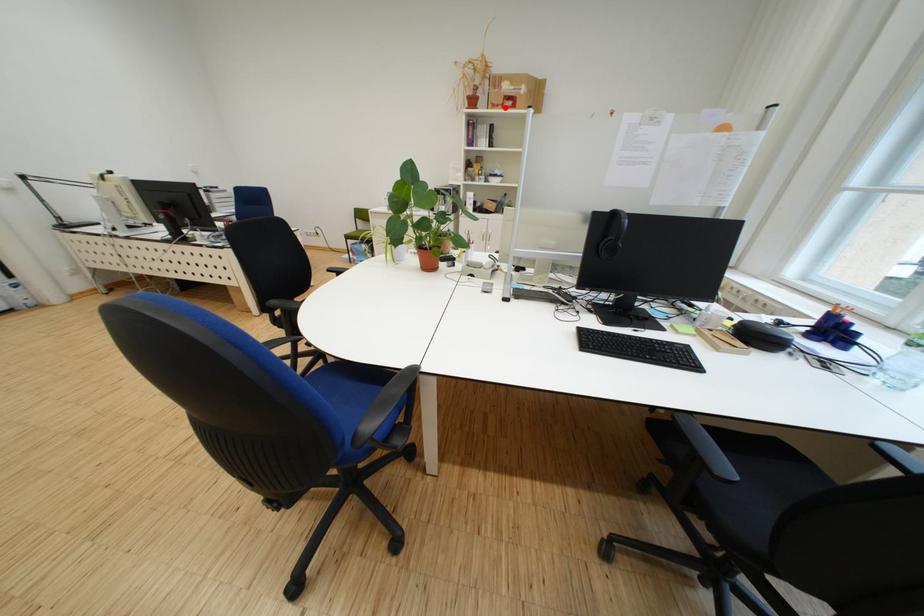
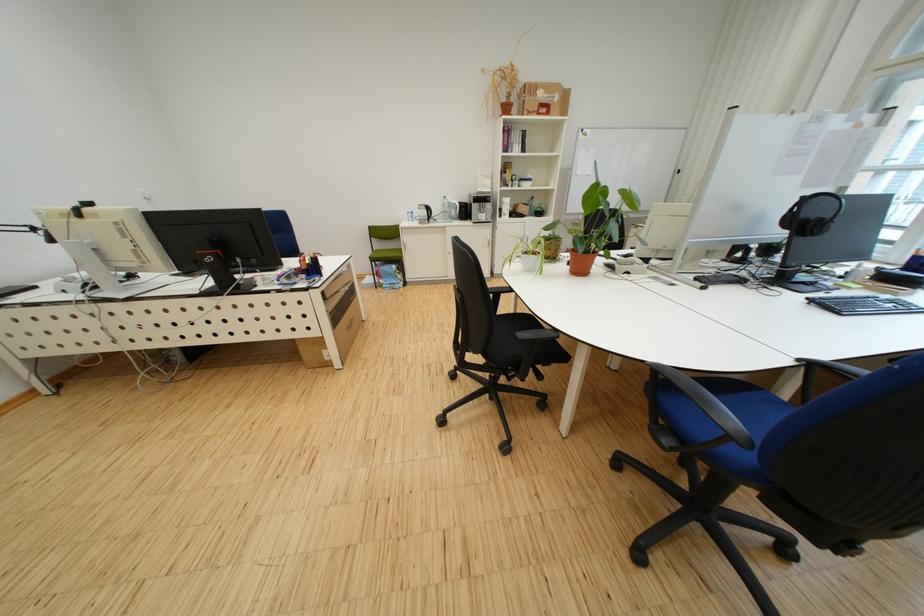
In the second image, find the point that corresponds to the highlighted location in the first image.

(541, 115)